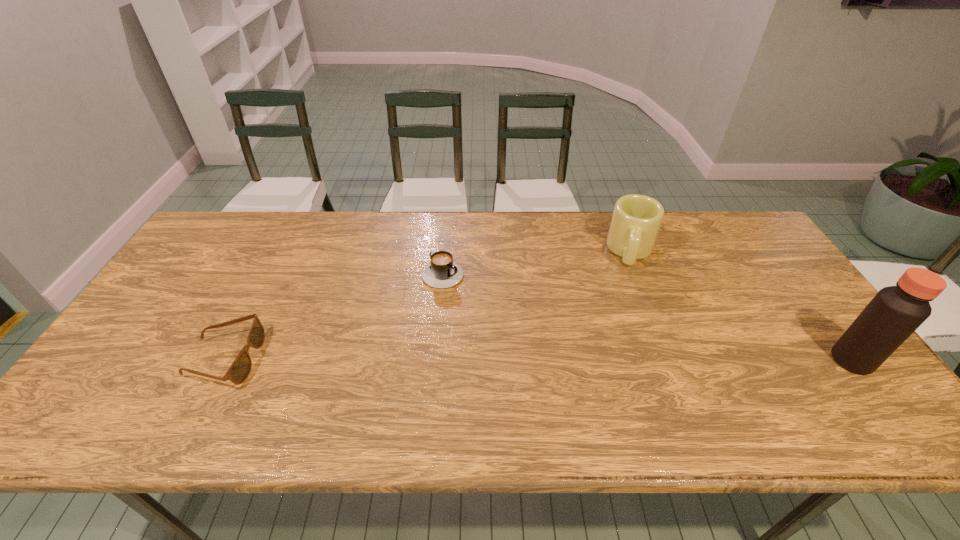
Find the location of a particular element. The height and width of the screenshot is (540, 960). free space between the cappuccino and the sunglasses is located at coordinates (334, 314).

The height and width of the screenshot is (540, 960). Find the location of `free space between the cappuccino and the mug`. free space between the cappuccino and the mug is located at coordinates (538, 261).

Locate an element on the screen. empty space that is in between the rightmost object and the third shortest object is located at coordinates (742, 306).

The image size is (960, 540). What are the coordinates of `blank region between the sunglasses and the second object from left to right` in the screenshot? It's located at (334, 314).

Where is `unoccupied position between the third object from left to right and the rightmost object`? This screenshot has height=540, width=960. unoccupied position between the third object from left to right and the rightmost object is located at coordinates (742, 306).

Locate an element on the screen. The width and height of the screenshot is (960, 540). free space that is in between the rightmost object and the sunglasses is located at coordinates pyautogui.click(x=539, y=359).

Find the location of a particular element. The width and height of the screenshot is (960, 540). object that is the second closest to the leftmost object is located at coordinates (636, 220).

Where is `object that is the closest to the third shortest object`? This screenshot has width=960, height=540. object that is the closest to the third shortest object is located at coordinates (895, 312).

Find the location of a particular element. free spot that satisfies the following two spatial constraints: 1. on the front side of the cappuccino; 2. on the right side of the tallest object is located at coordinates (435, 360).